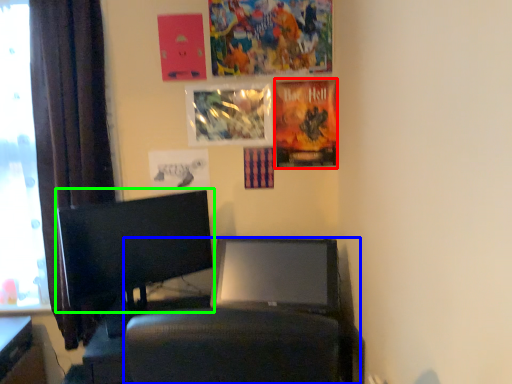
Question: Which object is positioned farthest from poster page (highlighted by a red box)? Select from computer chair (highlighted by a blue box) and computer monitor (highlighted by a green box).

Choices:
 (A) computer chair
 (B) computer monitor

Answer: (B)